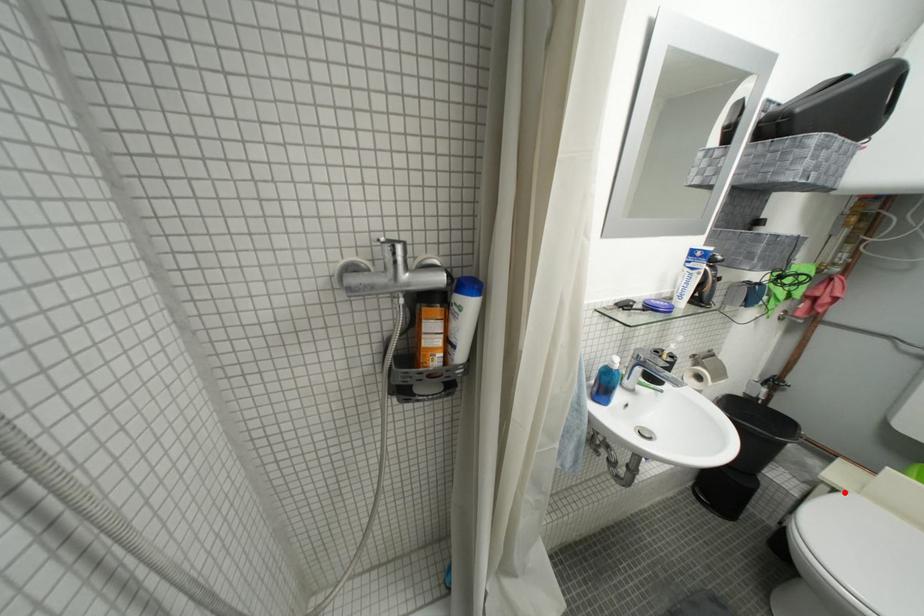
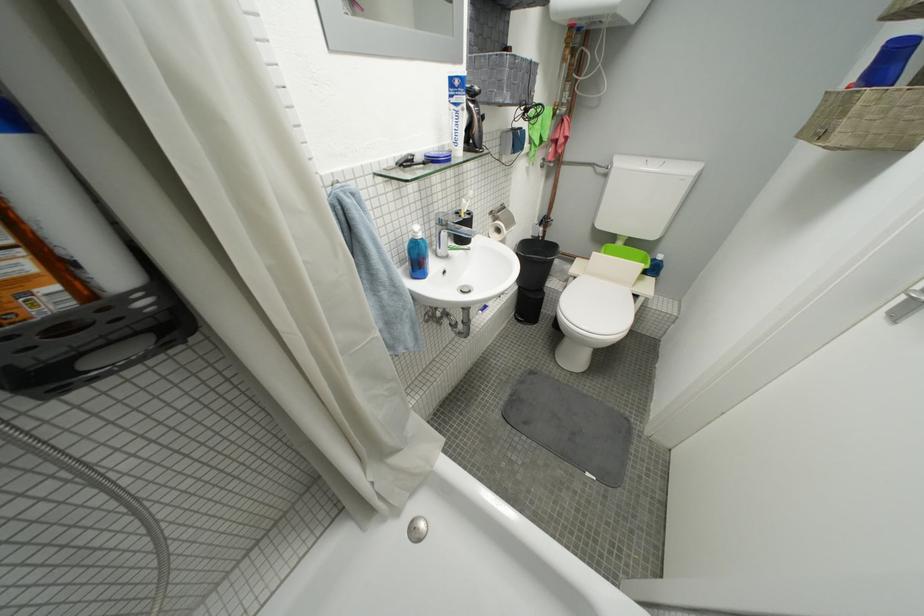
Find the pixel in the second image that matches the highlighted location in the first image.

(584, 281)